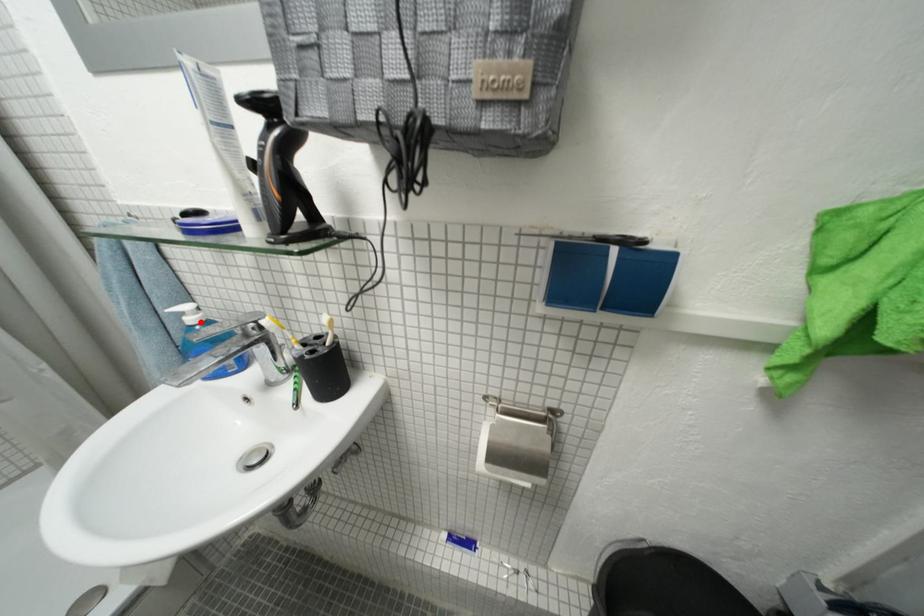
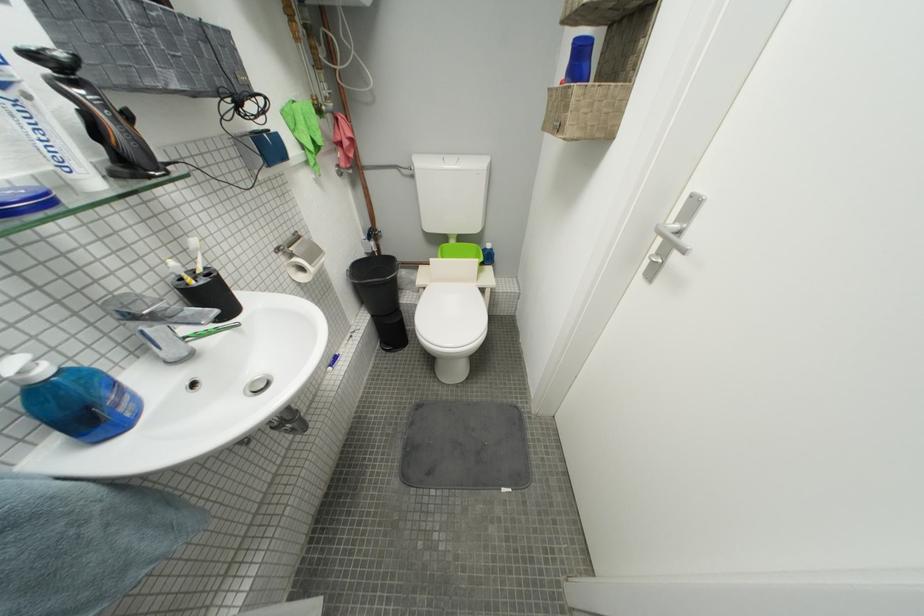
In the second image, find the point that corresponds to the highlighted location in the first image.

(53, 374)